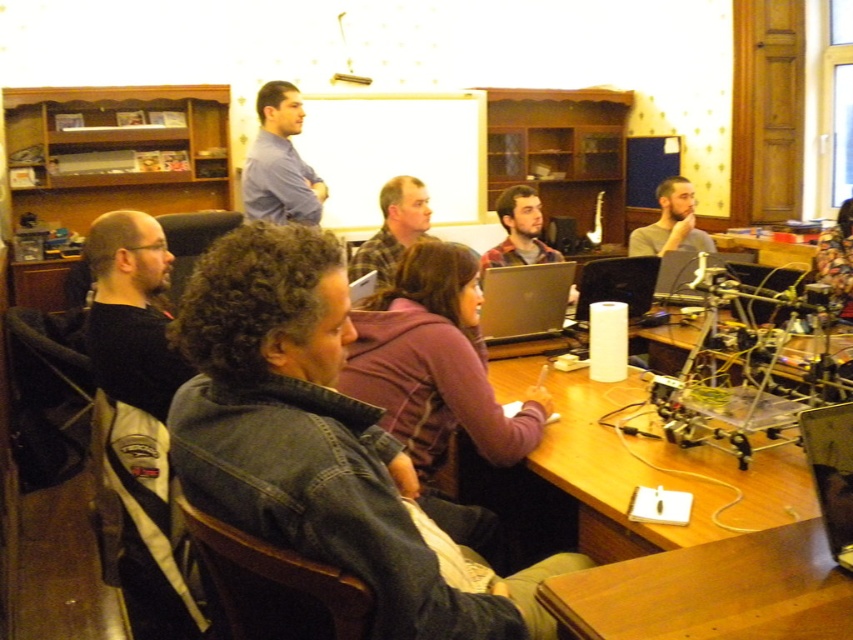
Question: Which of the following is the farthest from the observer?

Choices:
 (A) (665, 228)
 (B) (846, 257)
 (C) (848, 472)

Answer: (A)

Question: Which object is positioned farthest from the denim jacket at lower left?

Choices:
 (A) silver metallic laptop at center
 (B) wooden table at center
 (C) blue shirt at upper center
 (D) black plastic laptop at center

Answer: (C)

Question: Considering the real-world distances, which object is farthest from the black plastic laptop at center?

Choices:
 (A) plaid flannel shirt at center
 (B) black matte jacket at left

Answer: (B)

Question: From the image, what is the correct spatial relationship of wooden table at center in relation to smooth gray shirt at center?

Choices:
 (A) above
 (B) below

Answer: (B)

Question: Does wooden desk at lower right appear on the left side of black matte jacket at left?

Choices:
 (A) no
 (B) yes

Answer: (A)

Question: Observing the image, what is the correct spatial positioning of wooden desk at lower right in reference to floral fabric shirt at upper right?

Choices:
 (A) right
 (B) left

Answer: (B)